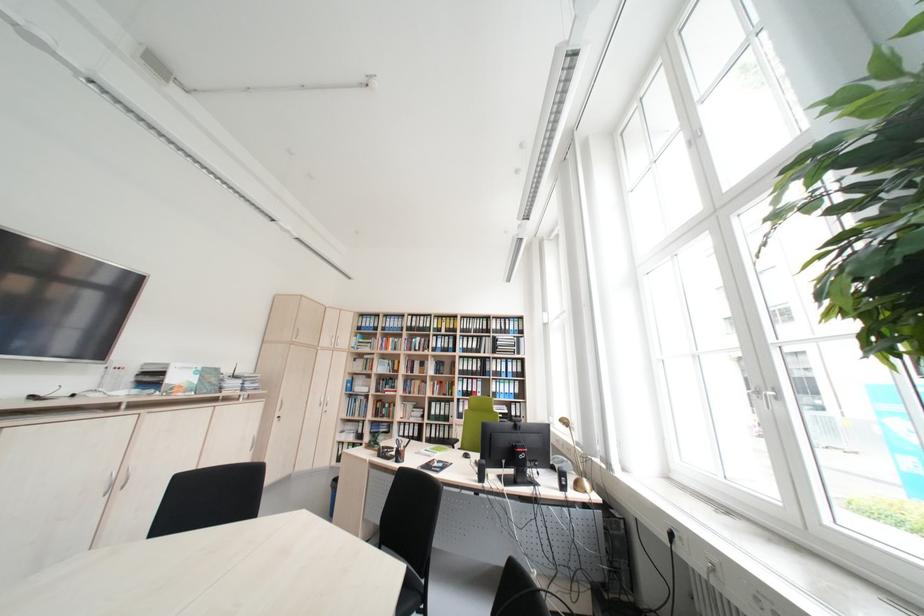
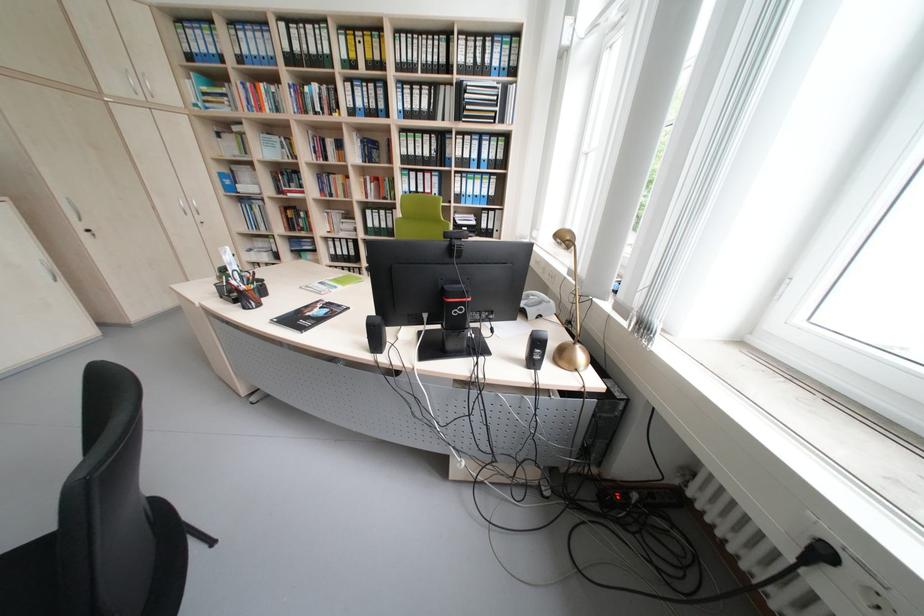
The point at (362,398) is marked in the first image. Where is the corresponding point in the second image?

(253, 201)